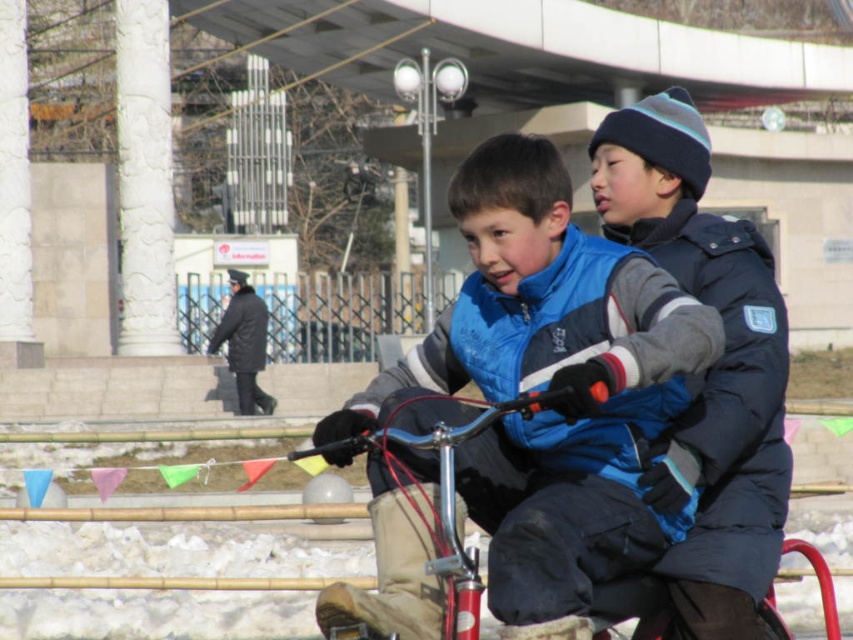
Which of these two, dark blue puffy jacket at center or white textured column at left, stands taller?

Standing taller between the two is dark blue puffy jacket at center.

Can you confirm if dark blue puffy jacket at center is positioned above white textured column at left?

Actually, dark blue puffy jacket at center is below white textured column at left.

Where is `dark blue puffy jacket at center`? This screenshot has height=640, width=853. dark blue puffy jacket at center is located at coordinates (708, 369).

Locate an element on the screen. The image size is (853, 640). dark blue puffy jacket at center is located at coordinates (708, 369).

Does metallic silver bicycle at center appear on the left side of white textured column at upper left?

Incorrect, metallic silver bicycle at center is not on the left side of white textured column at upper left.

Does metallic silver bicycle at center have a larger size compared to white textured column at upper left?

Actually, metallic silver bicycle at center might be smaller than white textured column at upper left.

Is point (364, 611) closer to camera compared to point (155, 108)?

That is True.

The height and width of the screenshot is (640, 853). Find the location of `metallic silver bicycle at center`. metallic silver bicycle at center is located at coordinates (418, 534).

Which is in front, point (583, 540) or point (462, 428)?

Point (462, 428) is more forward.

Can you confirm if blue fleece vest at center is wider than metallic silver bicycle at center?

Indeed, blue fleece vest at center has a greater width compared to metallic silver bicycle at center.

Who is more distant from viewer, [541,532] or [376,531]?

The point [376,531] is behind.

Where is `blue fleece vest at center`? blue fleece vest at center is located at coordinates (550, 387).